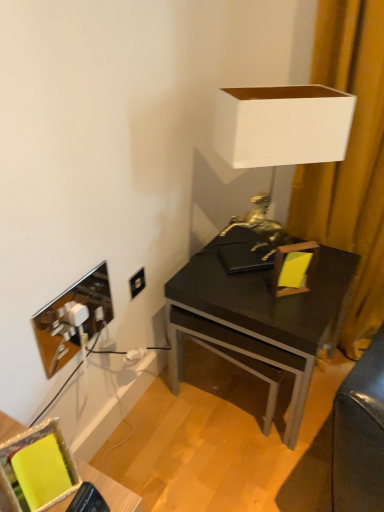
Question: Is yellow fabric picture frame at lower left, which ranks as the second picture frame in top-to-bottom order, not within black plastic power outlet at lower left?

Choices:
 (A) no
 (B) yes

Answer: (B)

Question: Does yellow fabric picture frame at lower left, which is counted as the 1th picture frame, starting from the bottom, have a lesser width compared to black plastic power outlet at lower left?

Choices:
 (A) no
 (B) yes

Answer: (A)

Question: Does yellow fabric picture frame at lower left, the 2th picture frame when ordered from back to front, have a smaller size compared to black plastic power outlet at lower left?

Choices:
 (A) yes
 (B) no

Answer: (B)

Question: Is yellow fabric picture frame at lower left, positioned as the 1th picture frame in front-to-back order, aimed at black plastic power outlet at lower left?

Choices:
 (A) no
 (B) yes

Answer: (A)

Question: Is yellow fabric picture frame at lower left, which ranks as the second picture frame in top-to-bottom order, bigger than black plastic power outlet at lower left?

Choices:
 (A) yes
 (B) no

Answer: (A)

Question: Considering the positions of white matte lampshade at upper right and matte black desk at center in the image, is white matte lampshade at upper right taller or shorter than matte black desk at center?

Choices:
 (A) tall
 (B) short

Answer: (A)

Question: Considering their positions, is white matte lampshade at upper right located in front of or behind matte black desk at center?

Choices:
 (A) front
 (B) behind

Answer: (A)

Question: Based on their sizes in the image, would you say white matte lampshade at upper right is bigger or smaller than matte black desk at center?

Choices:
 (A) small
 (B) big

Answer: (A)

Question: Visually, is white matte lampshade at upper right positioned to the left or to the right of matte black desk at center?

Choices:
 (A) left
 (B) right

Answer: (B)

Question: Is point (144, 271) closer or farther from the camera than point (1, 483)?

Choices:
 (A) closer
 (B) farther

Answer: (B)

Question: From a real-world perspective, is black plastic power outlet at lower left positioned above or below yellow fabric picture frame at lower left, positioned as the 1th picture frame in front-to-back order?

Choices:
 (A) above
 (B) below

Answer: (B)

Question: In the image, is black plastic power outlet at lower left on the left side or the right side of yellow fabric picture frame at lower left, which ranks as the second picture frame in top-to-bottom order?

Choices:
 (A) right
 (B) left

Answer: (A)

Question: In terms of width, does black plastic power outlet at lower left look wider or thinner when compared to yellow fabric picture frame at lower left, which ranks as the second picture frame in top-to-bottom order?

Choices:
 (A) thin
 (B) wide

Answer: (A)

Question: In terms of size, does matte black desk at center appear bigger or smaller than yellow fabric curtain at right?

Choices:
 (A) small
 (B) big

Answer: (B)

Question: From the image's perspective, is matte black desk at center above or below yellow fabric curtain at right?

Choices:
 (A) above
 (B) below

Answer: (B)